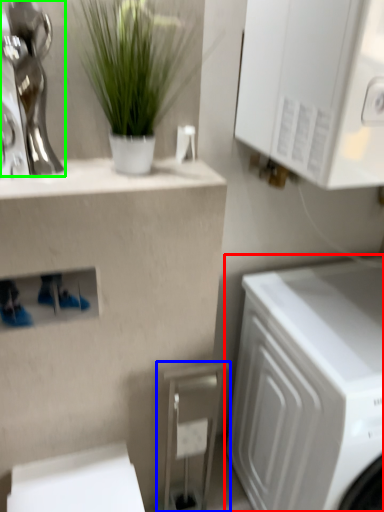
Question: Based on their relative distances, which object is nearer to washing machine (highlighted by a red box)? Choose from appliance (highlighted by a blue box) and statue (highlighted by a green box).

Choices:
 (A) appliance
 (B) statue

Answer: (A)